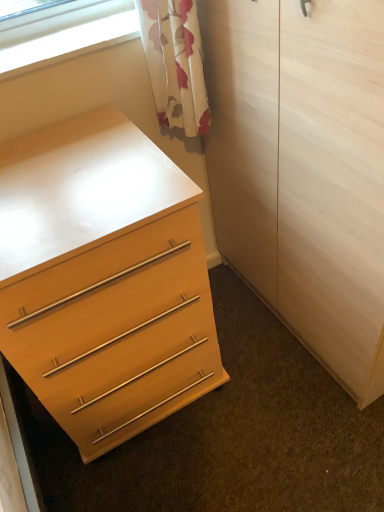
Where is `vacant area that lies to the right of matte wood chest of drawers at lower left`? This screenshot has width=384, height=512. vacant area that lies to the right of matte wood chest of drawers at lower left is located at coordinates (264, 385).